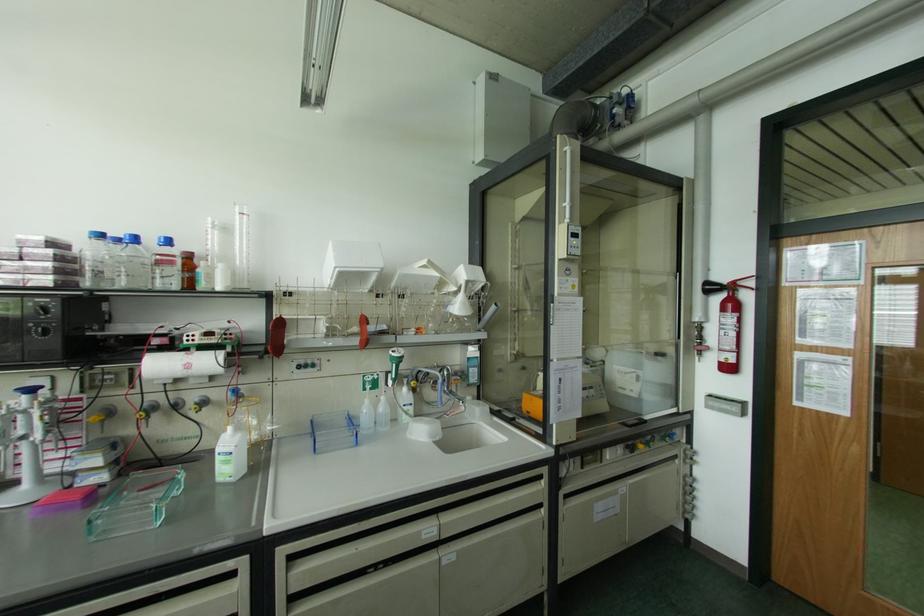
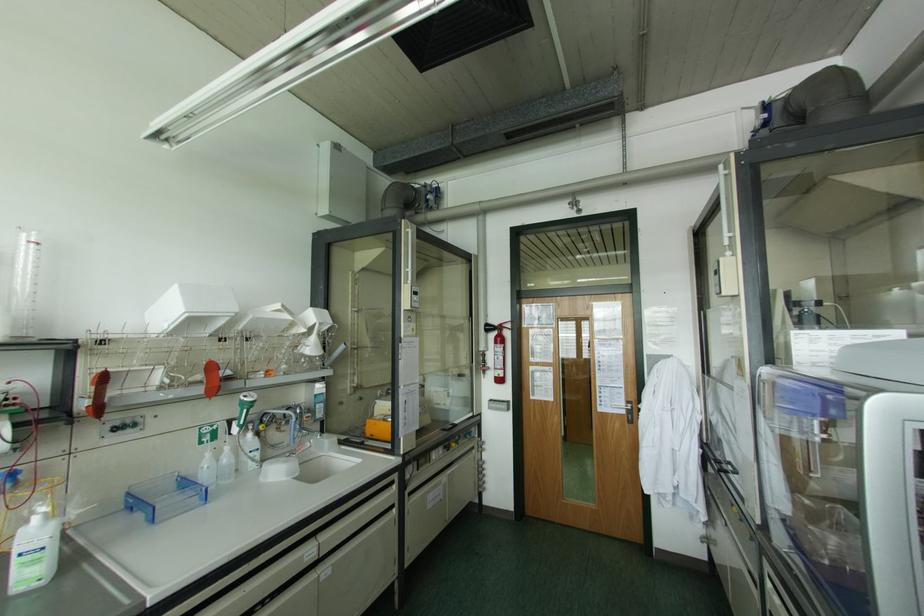
Locate, in the second image, the point that corresponds to point (675, 456) in the first image.

(472, 448)